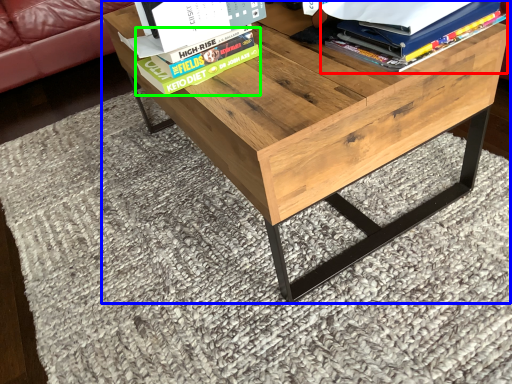
Question: Considering the real-world distances, which object is closest to book (highlighted by a red box)? table (highlighted by a blue box) or paperback book (highlighted by a green box).

Choices:
 (A) table
 (B) paperback book

Answer: (A)